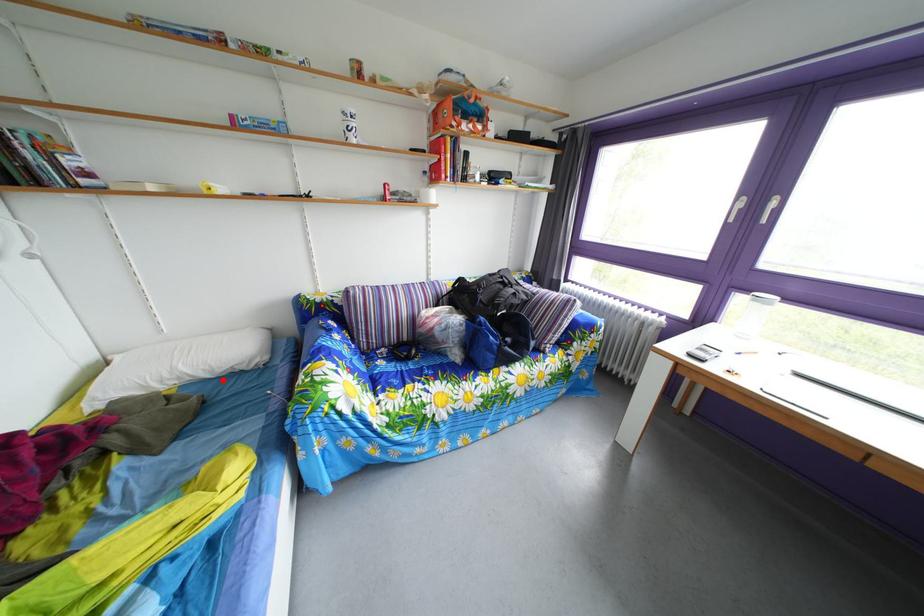
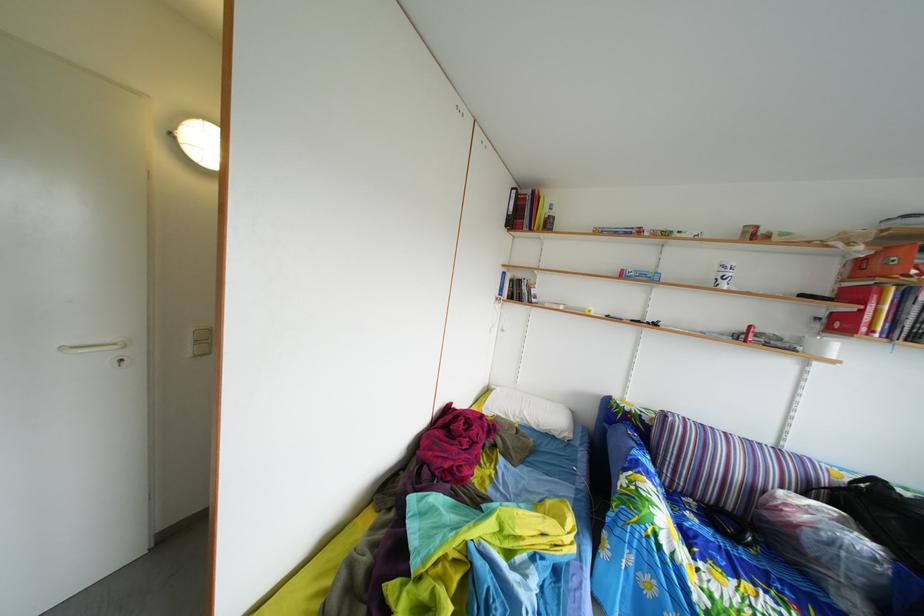
Question: I am providing you with two images of the same scene from different viewpoints. Given a red point in image1, look at the same physical point in image2. Is it:

Choices:
 (A) Closer to the viewpoint
 (B) Farther from the viewpoint

Answer: (B)